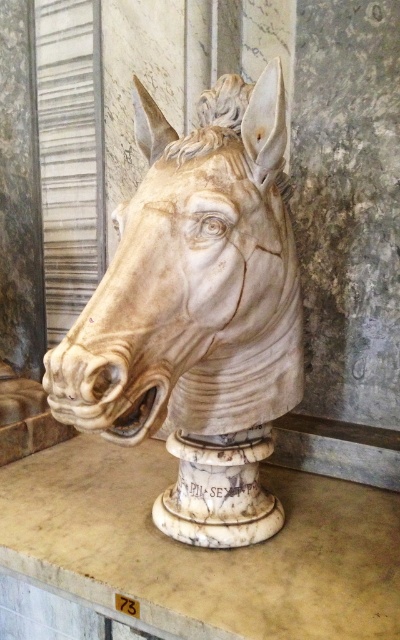
Can you confirm if white marble horse head at center is shorter than white marble pedestal at center?

Incorrect, white marble horse head at center's height does not fall short of white marble pedestal at center's.

Is point (225, 128) more distant than point (306, 600)?

Yes, it is.

Does point (220, 147) come closer to viewer compared to point (40, 506)?

Yes, it is in front of point (40, 506).

Where is `white marble horse head at center`? This screenshot has height=640, width=400. white marble horse head at center is located at coordinates (198, 314).